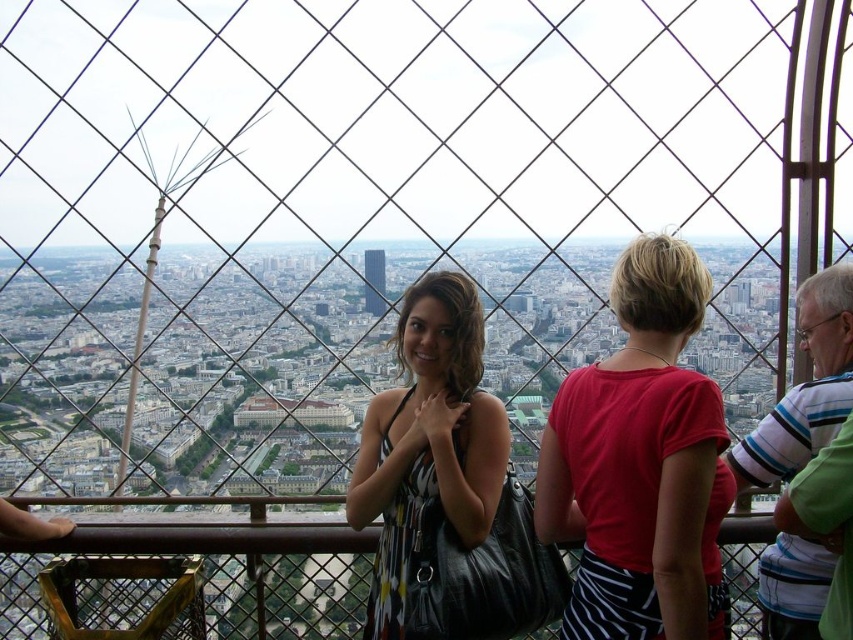
Looking at this image, who is shorter, printed fabric dress at center or brushed metal eiffel tower at left?

printed fabric dress at center is shorter.

Is printed fabric dress at center wider than brushed metal eiffel tower at left?

No.

Between point (492, 474) and point (154, 177), which one is positioned in front?

Point (492, 474) is more forward.

I want to click on printed fabric dress at center, so click(x=428, y=440).

Image resolution: width=853 pixels, height=640 pixels. What do you see at coordinates (640, 464) in the screenshot?
I see `red matte shirt at center` at bounding box center [640, 464].

The width and height of the screenshot is (853, 640). Find the location of `red matte shirt at center`. red matte shirt at center is located at coordinates (640, 464).

The width and height of the screenshot is (853, 640). In order to click on red matte shirt at center in this screenshot , I will do `click(640, 464)`.

Is red matte shirt at center above brushed metal eiffel tower at left?

No.

Can you confirm if red matte shirt at center is thinner than brushed metal eiffel tower at left?

Yes, red matte shirt at center is thinner than brushed metal eiffel tower at left.

Is point (709, 564) farther from camera compared to point (119, 468)?

No, it is not.

At what (x,y) coordinates should I click in order to perform the action: click on red matte shirt at center. Please return your answer as a coordinate pair (x, y). Looking at the image, I should click on (640, 464).